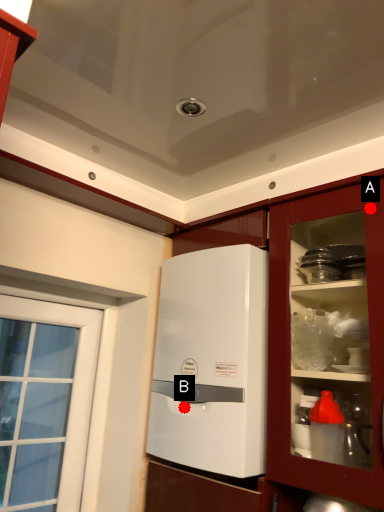
Question: Two points are circled on the image, labeled by A and B beside each circle. Which of the following is the farthest from the observer?

Choices:
 (A) A is further
 (B) B is further

Answer: (B)